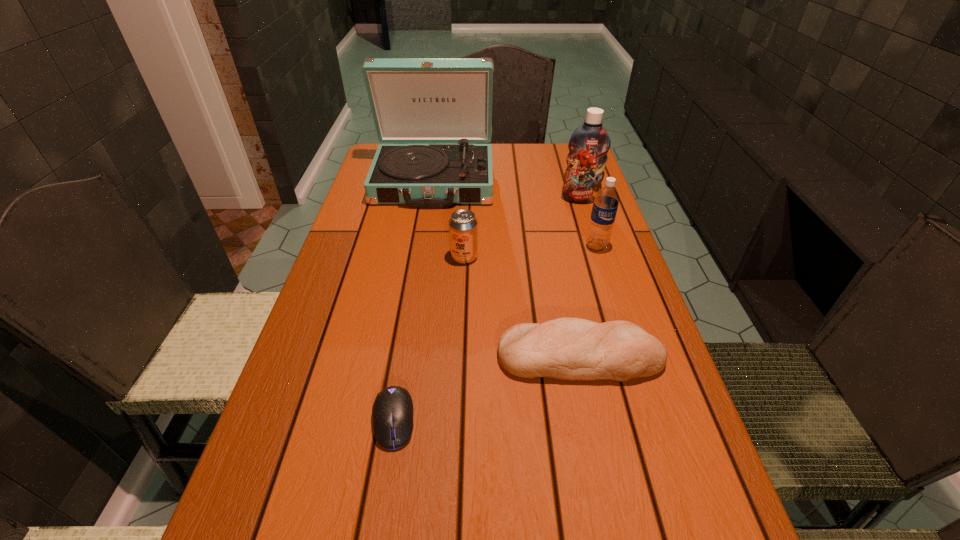
Find the location of `the tallest object`. the tallest object is located at coordinates (413, 100).

Where is `the second tallest object`? This screenshot has height=540, width=960. the second tallest object is located at coordinates (589, 144).

Image resolution: width=960 pixels, height=540 pixels. In order to click on the fourth shortest object in this screenshot , I will do `click(606, 201)`.

This screenshot has height=540, width=960. In order to click on beer can in this screenshot , I will do `click(463, 226)`.

Where is `the fifth farthest object`? This screenshot has height=540, width=960. the fifth farthest object is located at coordinates (566, 348).

Identify the location of bread. (566, 348).

Locate an element on the screen. the nearest object is located at coordinates (392, 412).

The height and width of the screenshot is (540, 960). Identify the location of computer mouse. (392, 412).

Identify the location of vacant region located on the face side of the record player. (427, 225).

I want to click on free space located 0.320m on the front label of the shampoo, so click(x=605, y=278).